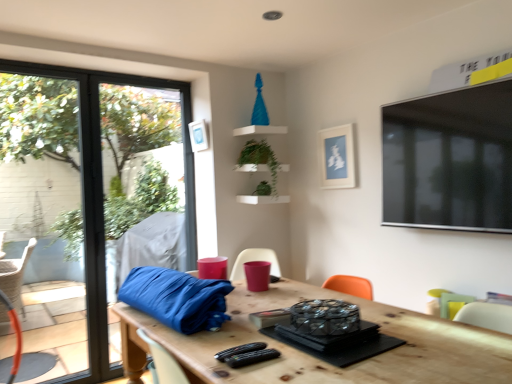
Question: Is pastel green fabric armchair at lower right, the 1th armchair ordered from the bottom, wider than white matte picture frame at upper center, the second picture frame in the left-to-right sequence?

Choices:
 (A) yes
 (B) no

Answer: (B)

Question: Would you say pastel green fabric armchair at lower right, which ranks as the second armchair in left-to-right order, is outside white matte picture frame at upper center, the second picture frame in the left-to-right sequence?

Choices:
 (A) yes
 (B) no

Answer: (A)

Question: Is pastel green fabric armchair at lower right, the 1th armchair ordered from the bottom, smaller than white matte picture frame at upper center, the second picture frame in the left-to-right sequence?

Choices:
 (A) yes
 (B) no

Answer: (A)

Question: Is the depth of pastel green fabric armchair at lower right, the 1th armchair ordered from the bottom, less than that of white matte picture frame at upper center, arranged as the 1th picture frame when viewed from the right?

Choices:
 (A) no
 (B) yes

Answer: (B)

Question: Can you confirm if pastel green fabric armchair at lower right, the 1th armchair ordered from the bottom, is bigger than white matte picture frame at upper center, arranged as the 1th picture frame when viewed from the right?

Choices:
 (A) yes
 (B) no

Answer: (B)

Question: Is the surface of pastel green fabric armchair at lower right, which ranks as the second armchair in left-to-right order, in direct contact with white matte picture frame at upper center, arranged as the 1th picture frame when viewed from the right?

Choices:
 (A) no
 (B) yes

Answer: (A)

Question: Considering the relative sizes of green leafy plant at upper center, which is the 1th plant in bottom-to-top order, and transparent glass window at left in the image provided, is green leafy plant at upper center, which is the 1th plant in bottom-to-top order, shorter than transparent glass window at left?

Choices:
 (A) yes
 (B) no

Answer: (A)

Question: Considering the relative sizes of green leafy plant at upper center, positioned as the second plant in top-to-bottom order, and transparent glass window at left in the image provided, is green leafy plant at upper center, positioned as the second plant in top-to-bottom order, bigger than transparent glass window at left?

Choices:
 (A) yes
 (B) no

Answer: (B)

Question: Considering the relative positions of green leafy plant at upper center, which is the 1th plant in bottom-to-top order, and transparent glass window at left in the image provided, is green leafy plant at upper center, which is the 1th plant in bottom-to-top order, in front of transparent glass window at left?

Choices:
 (A) no
 (B) yes

Answer: (A)

Question: Considering the relative sizes of green leafy plant at upper center, positioned as the second plant in top-to-bottom order, and transparent glass window at left in the image provided, is green leafy plant at upper center, positioned as the second plant in top-to-bottom order, wider than transparent glass window at left?

Choices:
 (A) yes
 (B) no

Answer: (A)

Question: Is green leafy plant at upper center, which is the 1th plant in bottom-to-top order, at the right side of transparent glass window at left?

Choices:
 (A) yes
 (B) no

Answer: (A)

Question: Is green leafy plant at upper center, positioned as the second plant in top-to-bottom order, at the left side of transparent glass window at left?

Choices:
 (A) yes
 (B) no

Answer: (B)

Question: Is green matte plant at upper center, marked as the first plant in a top-to-bottom arrangement, behind wooden table at center?

Choices:
 (A) no
 (B) yes

Answer: (B)